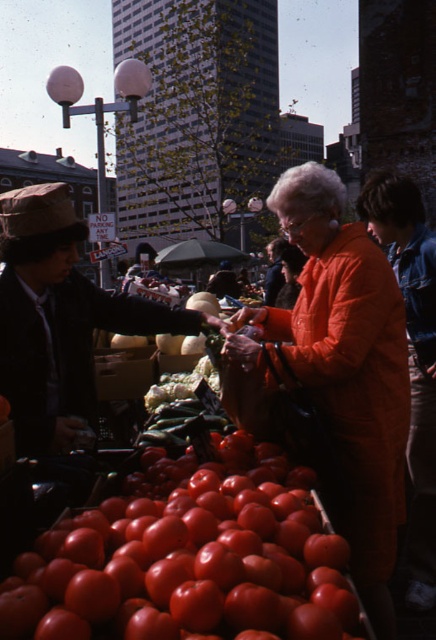
Who is higher up, glossy red tomato at lower center or matte black jacket at left?

Positioned higher is matte black jacket at left.

The width and height of the screenshot is (436, 640). In order to click on glossy red tomato at lower center in this screenshot , I will do coord(190,561).

Is point (121, 566) in front of point (153, 307)?

Yes, point (121, 566) is closer to viewer.

I want to click on glossy red tomato at lower center, so click(x=190, y=561).

Is glossy red tomato at lower center positioned behind green leafy lettuce at center?

No.

Can you confirm if glossy red tomato at lower center is smaller than green leafy lettuce at center?

No.

The height and width of the screenshot is (640, 436). Describe the element at coordinates (190, 561) in the screenshot. I see `glossy red tomato at lower center` at that location.

Locate an element on the screen. glossy red tomato at lower center is located at coordinates (190, 561).

Who is taller, orange fabric jacket at center or green leafy lettuce at center?

orange fabric jacket at center

You are a GUI agent. You are given a task and a screenshot of the screen. Output one action in this format:
    pyautogui.click(x=<x>, y=<y>)
    Task: Click on the orange fabric jacket at center
    Image resolution: width=436 pixels, height=640 pixels.
    Given the screenshot: What is the action you would take?
    pyautogui.click(x=341, y=371)